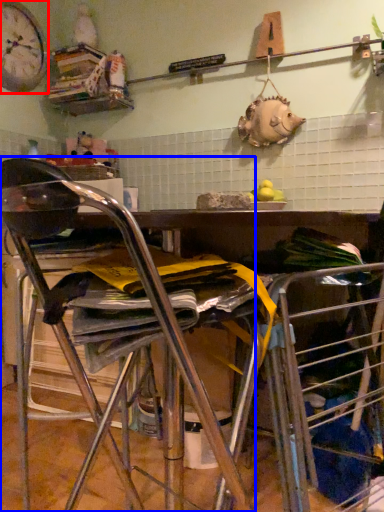
Question: Among these objects, which one is nearest to the camera, clock (highlighted by a red box) or chair (highlighted by a blue box)?

Choices:
 (A) clock
 (B) chair

Answer: (B)